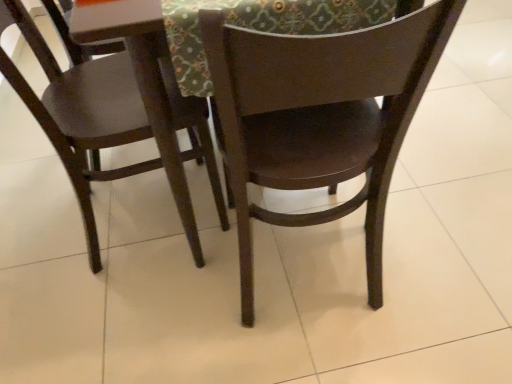
Find the location of a particular element. The height and width of the screenshot is (384, 512). vacant region to the left of dark wood chair at center, arranged as the second chair when viewed from the left is located at coordinates (161, 321).